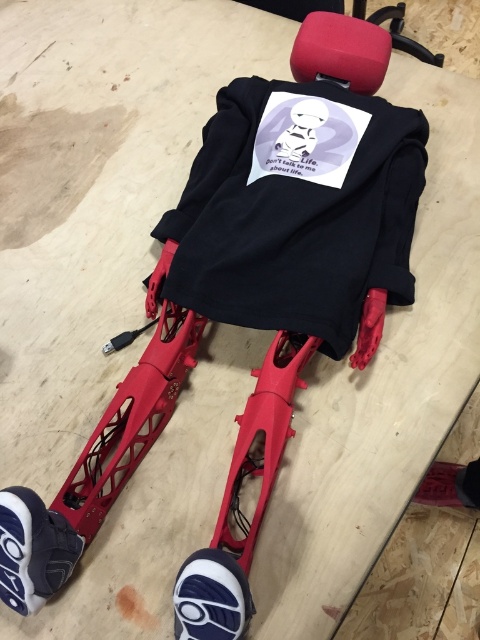
Question: Can you confirm if white textured shoe at lower left is bigger than dark gray rubber shoe at lower left?

Choices:
 (A) yes
 (B) no

Answer: (B)

Question: Which object is the farthest from the dark gray rubber shoe at lower left?

Choices:
 (A) white textured shoe at lower left
 (B) white rubber shoe at lower left

Answer: (A)

Question: Considering the relative positions of black matte sweatshirt at center and white rubber shoe at lower left in the image provided, where is black matte sweatshirt at center located with respect to white rubber shoe at lower left?

Choices:
 (A) above
 (B) below

Answer: (A)

Question: Which object appears closest to the camera in this image?

Choices:
 (A) black matte sweatshirt at center
 (B) white textured shoe at lower left
 (C) dark gray rubber shoe at lower left
 (D) white rubber shoe at lower left

Answer: (D)

Question: Can you confirm if black matte sweatshirt at center is wider than dark gray rubber shoe at lower left?

Choices:
 (A) yes
 (B) no

Answer: (A)

Question: Which object is positioned farthest from the white rubber shoe at lower left?

Choices:
 (A) dark gray rubber shoe at lower left
 (B) white textured shoe at lower left
 (C) black matte sweatshirt at center

Answer: (A)